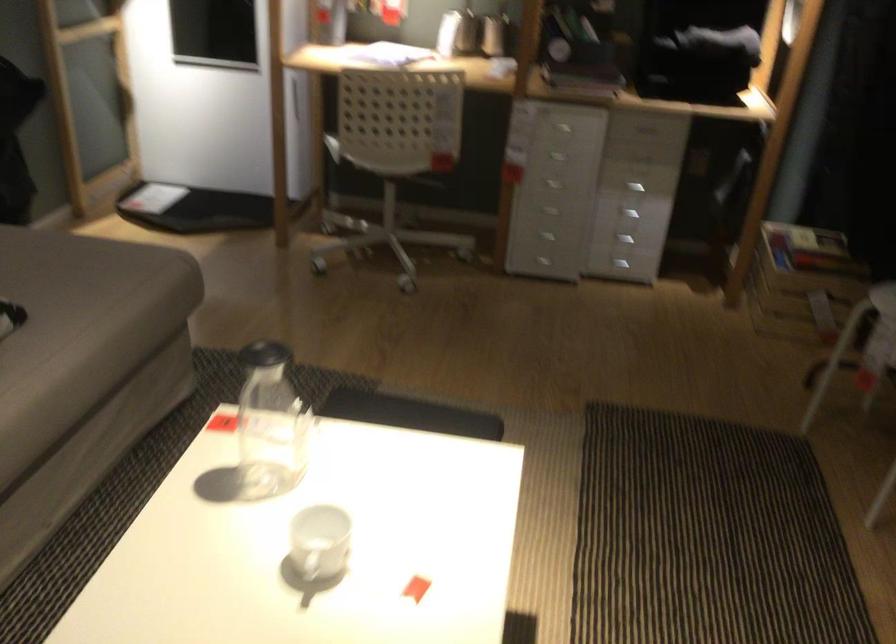
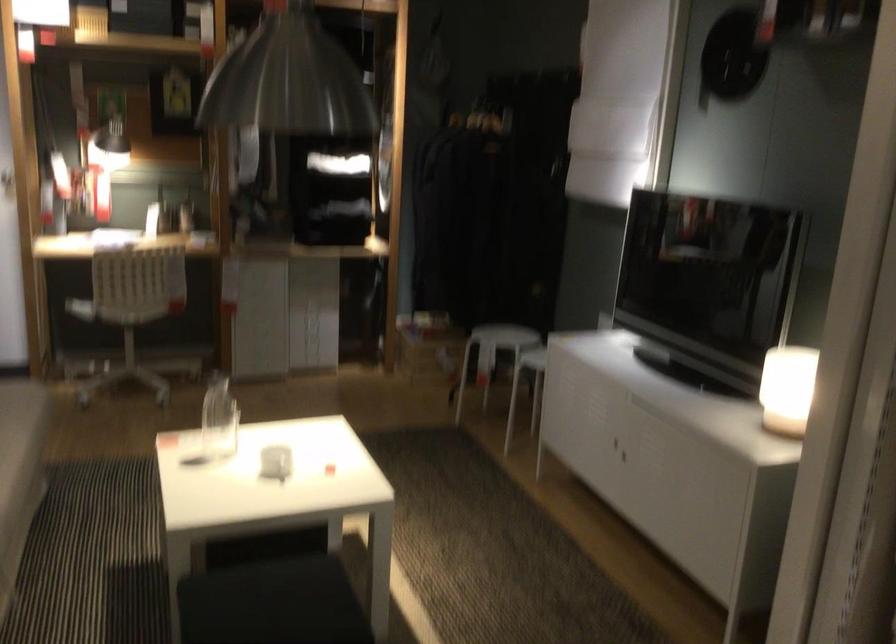
The point at (340, 149) is marked in the first image. Where is the corresponding point in the second image?

(80, 308)